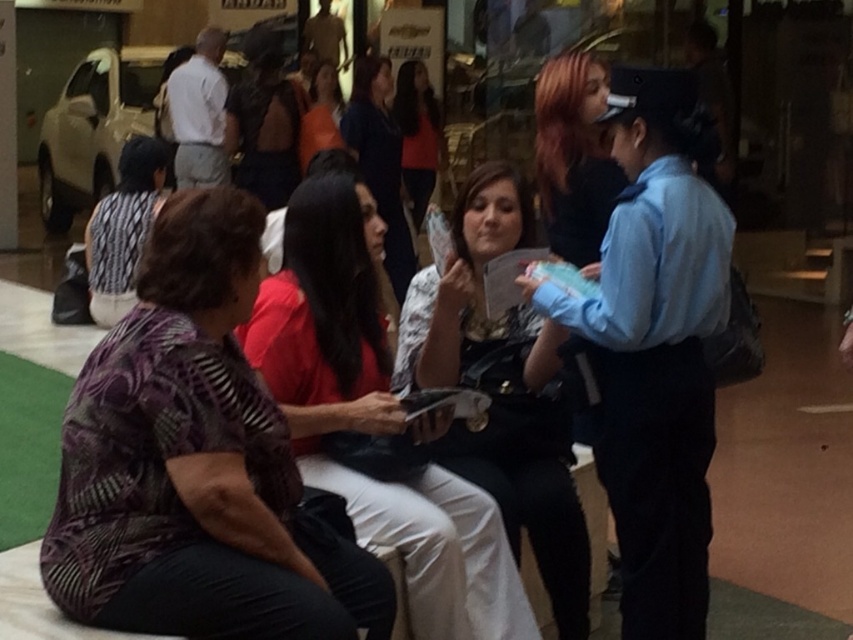
Between printed fabric blouse at center and matte black shirt at center, which one appears on the left side from the viewer's perspective?

matte black shirt at center

Does printed fabric blouse at center have a larger size compared to matte black shirt at center?

Incorrect, printed fabric blouse at center is not larger than matte black shirt at center.

Is point (505, 208) farther from camera compared to point (438, 112)?

No, it is in front of (438, 112).

Locate an element on the screen. This screenshot has height=640, width=853. printed fabric blouse at center is located at coordinates (502, 388).

What do you see at coordinates (195, 464) in the screenshot? I see `printed fabric blouse at left` at bounding box center [195, 464].

Is point (45, 588) closer to camera compared to point (412, 193)?

Yes.

Locate an element on the screen. printed fabric blouse at left is located at coordinates (195, 464).

Between point (160, 563) and point (468, 353), which one is positioned in front?

Point (160, 563) is more forward.

Can you confirm if printed fabric blouse at left is positioned below printed fabric blouse at center?

No, printed fabric blouse at left is not below printed fabric blouse at center.

Between point (148, 378) and point (519, 205), which one is positioned behind?

The point (519, 205) is more distant.

Where is `printed fabric blouse at left`? The width and height of the screenshot is (853, 640). printed fabric blouse at left is located at coordinates (195, 464).